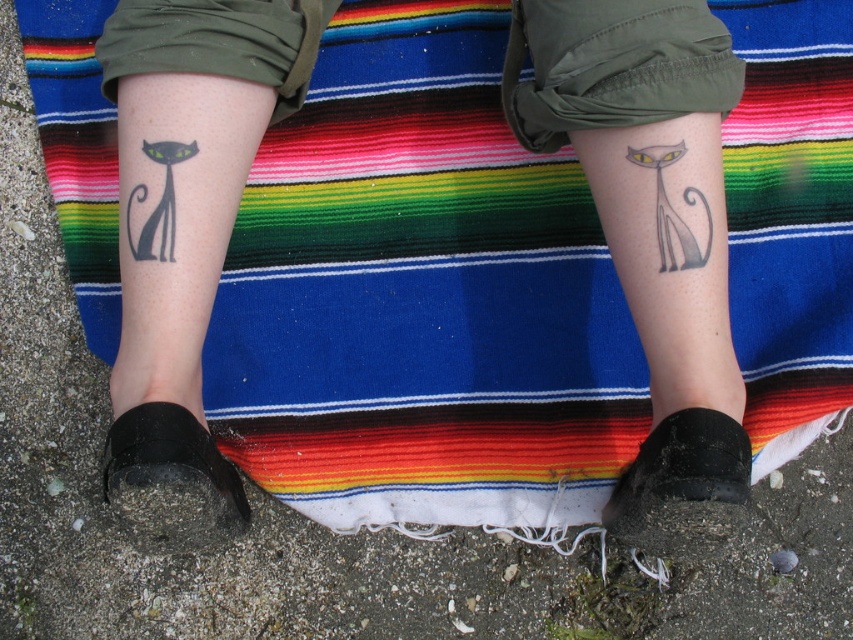
Is black matte tattoo at lower left to the left of black ink cat at right from the viewer's perspective?

Yes, black matte tattoo at lower left is to the left of black ink cat at right.

Is black matte tattoo at lower left thinner than black ink cat at right?

Incorrect, black matte tattoo at lower left's width is not less than black ink cat at right's.

The image size is (853, 640). Describe the element at coordinates (184, 232) in the screenshot. I see `black matte tattoo at lower left` at that location.

Where is `black matte tattoo at lower left`? Image resolution: width=853 pixels, height=640 pixels. black matte tattoo at lower left is located at coordinates (184, 232).

Between gray ink cat tattoo at lower center and black ink cat at right, which one is positioned lower?

gray ink cat tattoo at lower center is below.

Is gray ink cat tattoo at lower center to the left of black ink cat at right from the viewer's perspective?

Indeed, gray ink cat tattoo at lower center is positioned on the left side of black ink cat at right.

Describe the element at coordinates (653, 234) in the screenshot. The height and width of the screenshot is (640, 853). I see `gray ink cat tattoo at lower center` at that location.

Locate an element on the screen. gray ink cat tattoo at lower center is located at coordinates (653, 234).

Locate an element on the screen. The height and width of the screenshot is (640, 853). gray ink cat tattoo at lower center is located at coordinates (653, 234).

Which is more to the right, gray ink cat tattoo at lower center or black matte cat at left?

gray ink cat tattoo at lower center is more to the right.

Does point (669, 326) lie in front of point (141, 236)?

No, it is behind (141, 236).

Image resolution: width=853 pixels, height=640 pixels. Find the location of `gray ink cat tattoo at lower center`. gray ink cat tattoo at lower center is located at coordinates (653, 234).